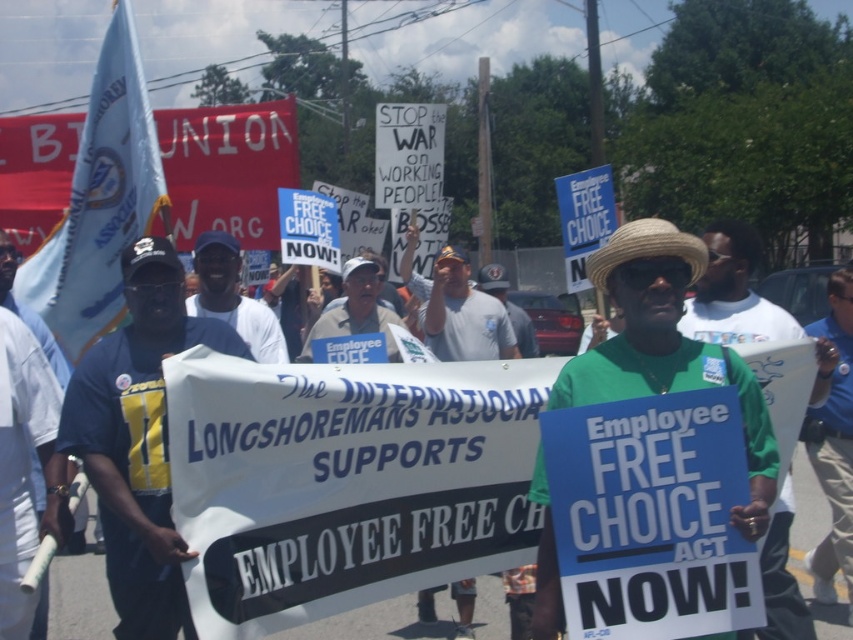
Is navy blue shirt at left smaller than green fabric shirt at center?

Correct, navy blue shirt at left occupies less space than green fabric shirt at center.

Who is more forward, (154, 419) or (450, 280)?

Positioned in front is point (154, 419).

Image resolution: width=853 pixels, height=640 pixels. Identify the location of navy blue shirt at left. (138, 438).

Is blue shirt at center in front of green fabric shirt at center?

Yes, blue shirt at center is in front of green fabric shirt at center.

Between point (851, 355) and point (462, 636), which one is positioned behind?

Positioned behind is point (462, 636).

Between point (845, 460) and point (436, 275), which one is positioned in front?

Positioned in front is point (845, 460).

Identify the location of blue shirt at center. (833, 444).

Is green straw hat at center to the right of blue fabric sign at center from the viewer's perspective?

Yes, green straw hat at center is to the right of blue fabric sign at center.

Is point (587, 369) farther from camera compared to point (351, 332)?

No, it is not.

Locate an element on the screen. The width and height of the screenshot is (853, 640). green straw hat at center is located at coordinates (666, 348).